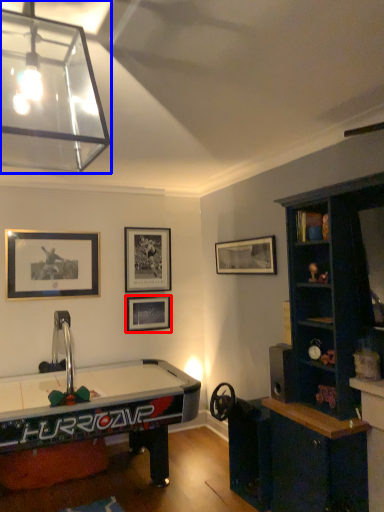
Question: Which of the following is the closest to the observer, picture frame (highlighted by a red box) or lamp (highlighted by a blue box)?

Choices:
 (A) picture frame
 (B) lamp

Answer: (B)